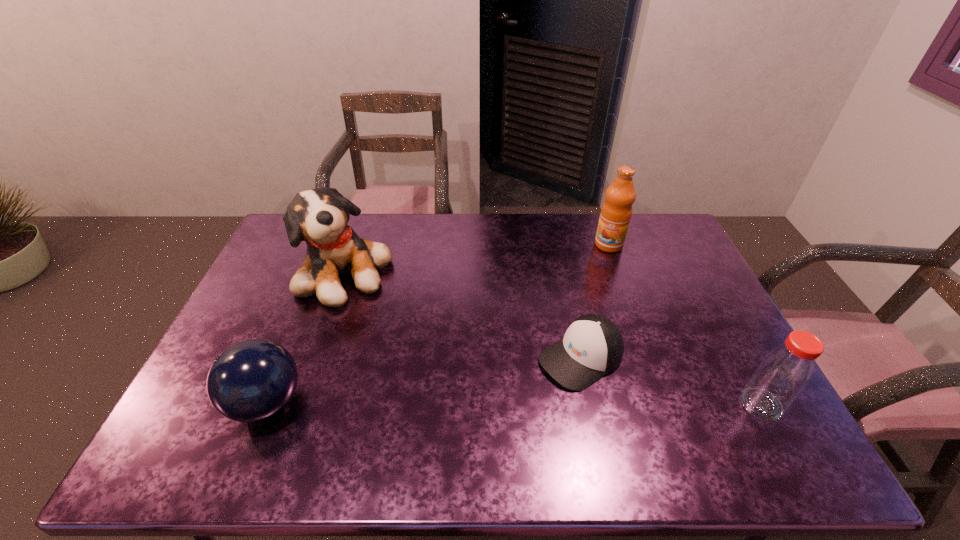
In order to click on puppy that is positioned at the far edge in this screenshot , I will do click(319, 217).

At what (x,y) coordinates should I click in order to perform the action: click on bowling ball present at the near edge. Please return your answer as a coordinate pair (x, y). Looking at the image, I should click on (252, 380).

This screenshot has height=540, width=960. Find the location of `bottle positioned at the near edge`. bottle positioned at the near edge is located at coordinates (783, 374).

In order to click on bowling ball located at the left edge in this screenshot , I will do `click(252, 380)`.

Identify the location of puppy that is positioned at the left edge. The height and width of the screenshot is (540, 960). (319, 217).

This screenshot has width=960, height=540. Find the location of `object present at the right edge`. object present at the right edge is located at coordinates (783, 374).

Image resolution: width=960 pixels, height=540 pixels. I want to click on object located in the far left corner section of the desktop, so click(x=319, y=217).

Where is `object that is positioned at the near left corner`? The width and height of the screenshot is (960, 540). object that is positioned at the near left corner is located at coordinates (252, 380).

Where is `object that is at the near right corner`? object that is at the near right corner is located at coordinates (783, 374).

Where is `free space at the far edge`? The width and height of the screenshot is (960, 540). free space at the far edge is located at coordinates (526, 214).